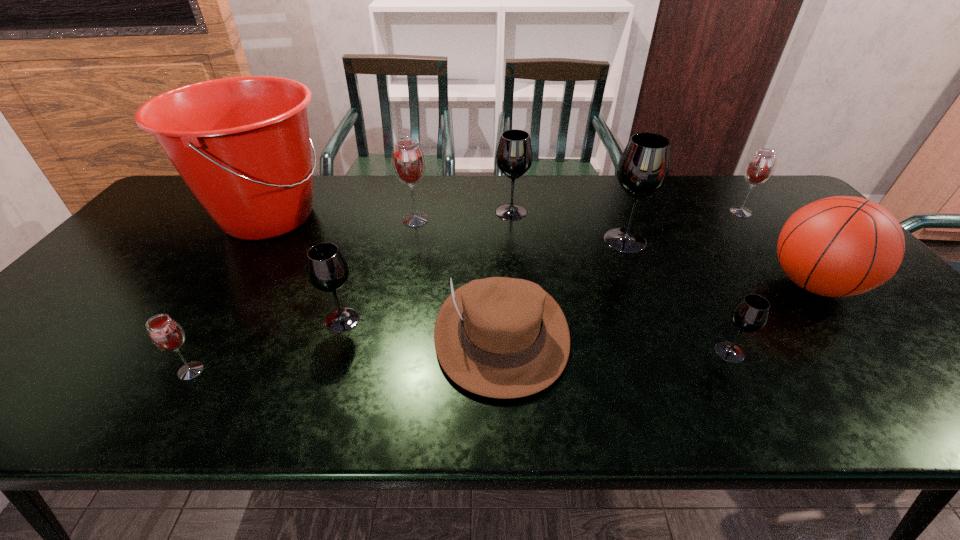
The image size is (960, 540). In order to click on vacant space located 0.220m on the front of the second gray wineglass from left to right in this screenshot , I will do pyautogui.click(x=516, y=267).

This screenshot has width=960, height=540. I want to click on free point located on the front of the seventh object from right to left, so click(397, 311).

Identify the location of vacant area situated 0.250m on the left of the basketball. The width and height of the screenshot is (960, 540). (669, 285).

Identify the location of vacant space located 0.080m on the left of the rightmost wineglass. Image resolution: width=960 pixels, height=540 pixels. (703, 212).

Find the location of a particular element. Image resolution: width=960 pixels, height=540 pixels. free location located 0.310m on the left of the third biggest gray wineglass is located at coordinates (194, 320).

Where is `vacant point located 0.270m on the right of the rightmost gray wineglass`? vacant point located 0.270m on the right of the rightmost gray wineglass is located at coordinates (866, 352).

At what (x,y) coordinates should I click in order to perform the action: click on vacant area situated on the right of the smallest red wineglass. Please return your answer as a coordinate pair (x, y). This screenshot has width=960, height=540. Looking at the image, I should click on (370, 371).

You are a GUI agent. You are given a task and a screenshot of the screen. Output one action in this format:
    pyautogui.click(x=<x>, y=<y>)
    Task: Click on the bucket that is positioned at the far edge
    This screenshot has width=960, height=540.
    Given the screenshot: What is the action you would take?
    pyautogui.click(x=241, y=144)

Locate an element on the screen. fedora present at the near edge is located at coordinates (499, 337).

Image resolution: width=960 pixels, height=540 pixels. Find the location of `wineglass that is positioned at the near edge`. wineglass that is positioned at the near edge is located at coordinates (166, 334).